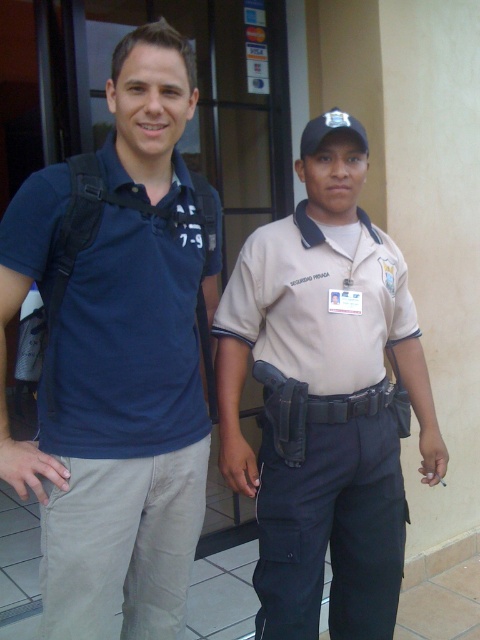
Question: Among these points, which one is farthest from the camera?

Choices:
 (A) (395, 493)
 (B) (157, 536)

Answer: (A)

Question: Which of the following is the farthest from the observer?

Choices:
 (A) (39, 426)
 (B) (277, 484)

Answer: (B)

Question: Can you confirm if matte blue shirt at left is positioned above tan fabric shirt at center?

Choices:
 (A) yes
 (B) no

Answer: (A)

Question: Is matte blue shirt at left closer to the viewer compared to tan fabric shirt at center?

Choices:
 (A) no
 (B) yes

Answer: (B)

Question: Which point is farther to the camera?

Choices:
 (A) matte blue shirt at left
 (B) tan fabric shirt at center

Answer: (B)

Question: Where is matte blue shirt at left located in relation to tan fabric shirt at center in the image?

Choices:
 (A) right
 (B) left

Answer: (B)